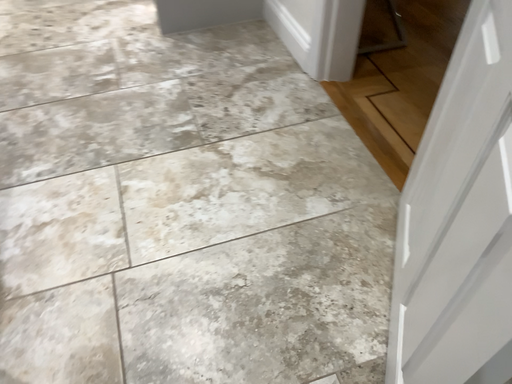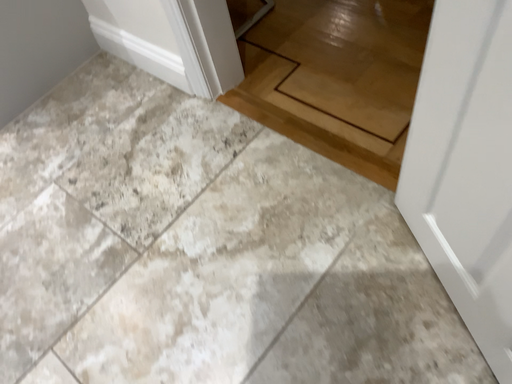
Question: Which way did the camera rotate in the video?

Choices:
 (A) rotated right
 (B) rotated left

Answer: (A)